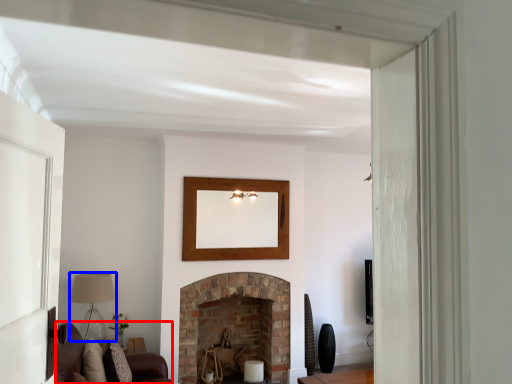
Question: Which point is further to the camera, couch (highlighted by a red box) or lamp (highlighted by a blue box)?

Choices:
 (A) couch
 (B) lamp

Answer: (B)